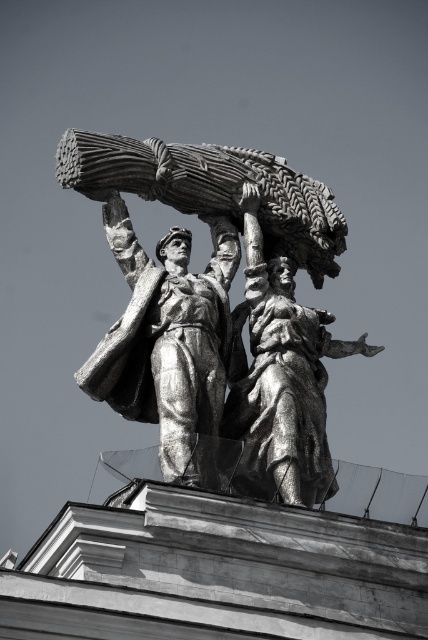
Which is more to the left, bronze statue at center or shiny silver statue at center?

From the viewer's perspective, bronze statue at center appears more on the left side.

Does point (154, 380) come behind point (189, 289)?

No, it is in front of (189, 289).

At what (x,y) coordinates should I click in order to perform the action: click on bronze statue at center. Please return your answer as a coordinate pair (x, y). This screenshot has width=428, height=640. Looking at the image, I should click on (219, 312).